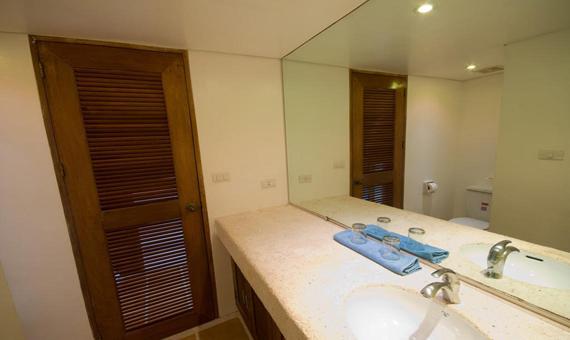
Where is `faucet`? This screenshot has width=570, height=340. faucet is located at coordinates (431, 289).